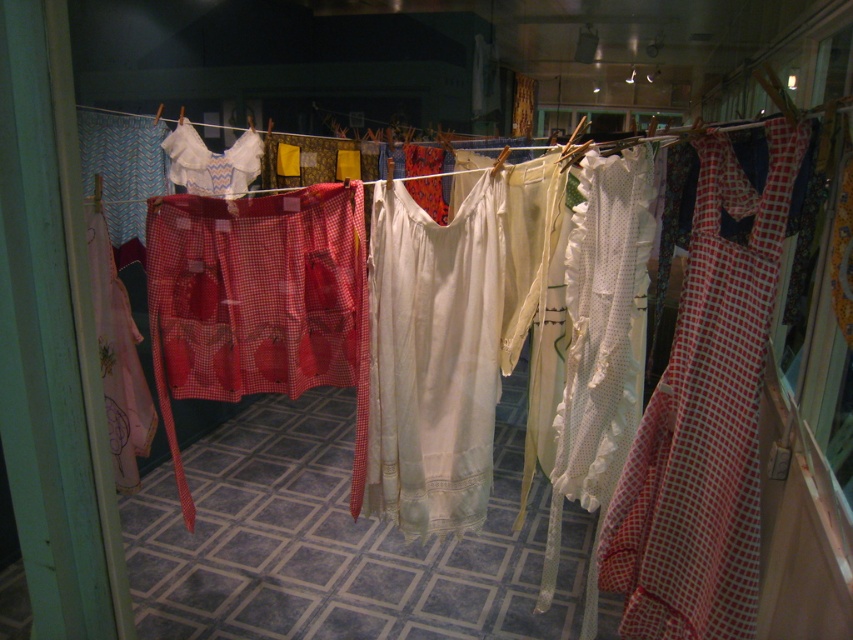
You are a visitor standing in front of the vintage clothing display. You see the red checkered dress at right and the white cotton dress at center. Which dress is positioned closer to you?

The red checkered dress at right is closer to the viewer than the white cotton dress at center.

You are a visitor standing in front of the vintage clothing display. You notice the white cotton dress at center. Can you determine its exact position in the exhibit using coordinates?

The white cotton dress at center is located at coordinates point [433,356].